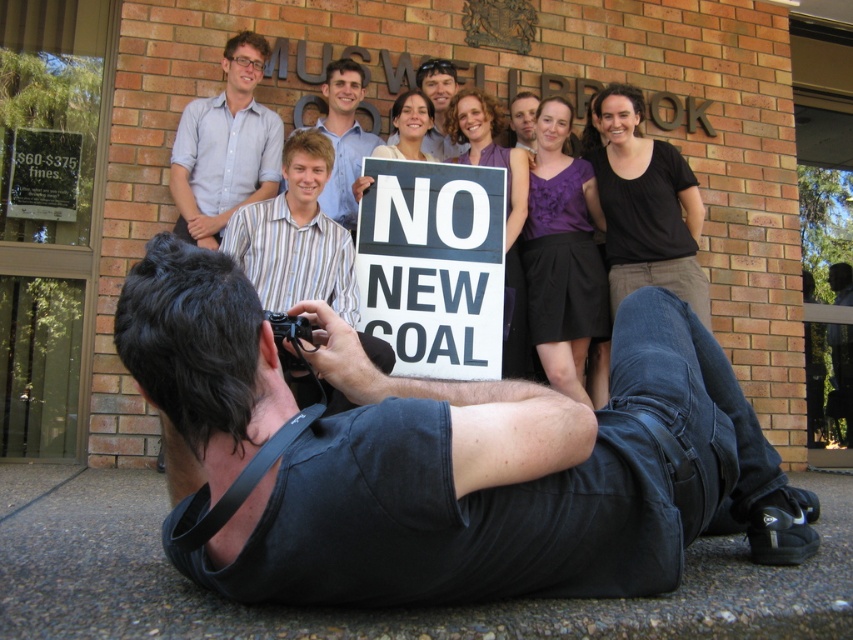
Does black cotton shirt at lower center have a greater width compared to white paper sign at upper left?

Indeed, black cotton shirt at lower center has a greater width compared to white paper sign at upper left.

Is point (621, 401) farther from camera compared to point (61, 220)?

No, (621, 401) is in front of (61, 220).

Identify the location of black cotton shirt at lower center. Image resolution: width=853 pixels, height=640 pixels. (440, 458).

Measure the distance between point (465,218) and camera.

The distance of point (465,218) from camera is 3.89 meters.

Is the position of white plastic sign at center less distant than that of striped cotton shirt at center?

No, it is not.

Locate an element on the screen. The image size is (853, 640). white plastic sign at center is located at coordinates (433, 266).

Between white plastic sign at center and matte blue shirt at center, which one has more height?

white plastic sign at center

Looking at this image, can you confirm if white plastic sign at center is wider than matte blue shirt at center?

Correct, the width of white plastic sign at center exceeds that of matte blue shirt at center.

Is point (360, 273) in front of point (450, 84)?

Yes, point (360, 273) is in front of point (450, 84).

Locate an element on the screen. This screenshot has width=853, height=640. white plastic sign at center is located at coordinates (433, 266).